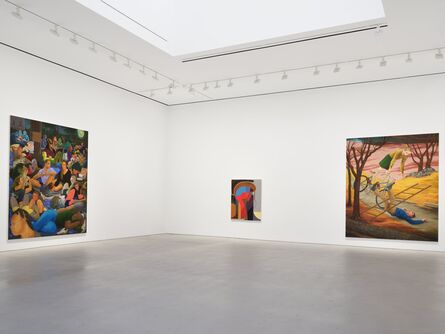
In order to click on corner of oil painting on right side in this screenshot , I will do `click(348, 139)`, `click(438, 131)`, `click(346, 233)`, `click(437, 240)`.